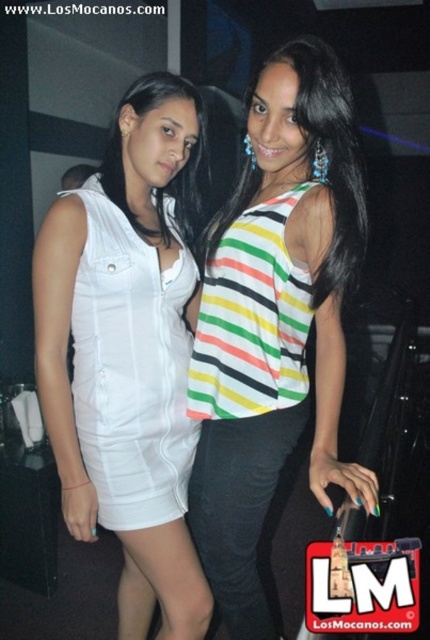
Question: Which of these objects is positioned closest to the striped fabric blouse at center?

Choices:
 (A) white matte dress at left
 (B) white satin dress at left

Answer: (A)

Question: Does white matte dress at left appear on the left side of striped fabric blouse at center?

Choices:
 (A) yes
 (B) no

Answer: (A)

Question: Is white satin dress at left positioned at the back of striped fabric blouse at center?

Choices:
 (A) yes
 (B) no

Answer: (A)

Question: Which object appears closest to the camera in this image?

Choices:
 (A) white satin dress at left
 (B) striped fabric blouse at center

Answer: (B)

Question: Based on their relative distances, which object is farther from the white satin dress at left?

Choices:
 (A) white matte dress at left
 (B) striped fabric top at center

Answer: (B)

Question: Is striped fabric top at center smaller than white satin dress at left?

Choices:
 (A) no
 (B) yes

Answer: (A)